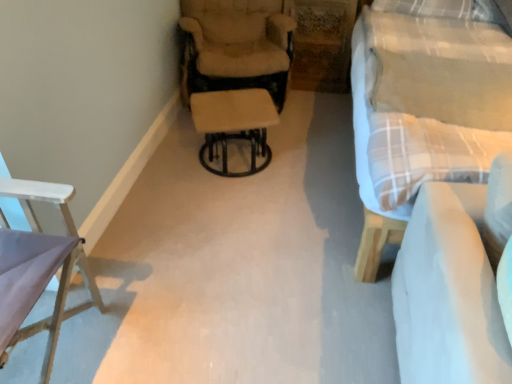
Where is `white fabric couch at lower right`? This screenshot has height=384, width=512. white fabric couch at lower right is located at coordinates (448, 292).

How different are the orientations of white fabric couch at lower right and beige fabric chair at center, the second chair viewed from the left, in degrees?

The facing directions of white fabric couch at lower right and beige fabric chair at center, the second chair viewed from the left, are 60.5 degrees apart.

Could you tell me if white fabric couch at lower right is facing beige fabric chair at center, the second chair viewed from the left?

No.

Considering the positions of point (434, 380) and point (263, 154), is point (434, 380) closer or farther from the camera than point (263, 154)?

Point (434, 380) appears to be closer to the viewer than point (263, 154).

From a real-world perspective, is white fabric couch at lower right physically located above or below beige fabric chair at center, the 2th chair when ordered from front to back?

Clearly, from a real-world perspective, white fabric couch at lower right is above beige fabric chair at center, the 2th chair when ordered from front to back.

Could white wood chair at left, acting as the 1th chair starting from the front, be considered to be inside white fabric couch at lower right?

No, white wood chair at left, acting as the 1th chair starting from the front, is not a part of white fabric couch at lower right.

From the image's perspective, would you say white fabric couch at lower right is shown under white wood chair at left, which appears as the second chair when viewed from the top?

Yes, from the image's perspective, white fabric couch at lower right is below white wood chair at left, which appears as the second chair when viewed from the top.

Is white fabric couch at lower right not close to white wood chair at left, acting as the 1th chair starting from the front?

Yes.

Does white fabric couch at lower right come in front of white wood chair at left, acting as the 1th chair starting from the front?

Yes, it is.

Is white fabric couch at lower right inside the boundaries of black metal stool at center, or outside?

white fabric couch at lower right is outside black metal stool at center.

Between white fabric couch at lower right and black metal stool at center, which one has less height?

Standing shorter between the two is black metal stool at center.

Does white fabric couch at lower right appear on the left side of black metal stool at center?

→ No.

Does white fabric couch at lower right touch black metal stool at center?

No, white fabric couch at lower right is not in contact with black metal stool at center.

Which of these two, white fabric couch at lower right or plaid fabric studio couch at right, stands shorter?

white fabric couch at lower right is shorter.

This screenshot has height=384, width=512. There is a plaid fabric studio couch at right. In order to click on couch above it (from a real-world perspective) in this screenshot , I will do `click(448, 292)`.

Between white fabric couch at lower right and plaid fabric studio couch at right, which one is positioned in front?

white fabric couch at lower right is more forward.

From the image's perspective, is white fabric couch at lower right under plaid fabric studio couch at right?

Yes, from the image's perspective, white fabric couch at lower right is below plaid fabric studio couch at right.

Are plaid fabric studio couch at right and black metal stool at center located far from each other?

plaid fabric studio couch at right is near black metal stool at center, not far away.

Is plaid fabric studio couch at right turned away from black metal stool at center?

plaid fabric studio couch at right is not turned away from black metal stool at center.

From the image's perspective, is plaid fabric studio couch at right above or below black metal stool at center?

plaid fabric studio couch at right is above black metal stool at center.

Is plaid fabric studio couch at right inside the boundaries of black metal stool at center, or outside?

plaid fabric studio couch at right exists outside the volume of black metal stool at center.

Which of these two, black metal stool at center or beige fabric chair at center, the 1th chair positioned from the back, is thinner?

With smaller width is black metal stool at center.

Considering the sizes of black metal stool at center and beige fabric chair at center, placed as the second chair when sorted from bottom to top, in the image, is black metal stool at center bigger or smaller than beige fabric chair at center, placed as the second chair when sorted from bottom to top,?

black metal stool at center is smaller than beige fabric chair at center, placed as the second chair when sorted from bottom to top.

How different are the orientations of black metal stool at center and beige fabric chair at center, the second chair viewed from the left, in degrees?

There is a 0.151-degree angle between the facing directions of black metal stool at center and beige fabric chair at center, the second chair viewed from the left.

Relative to beige fabric chair at center, arranged as the 1th chair when viewed from the top, is black metal stool at center in front or behind?

Visually, black metal stool at center is located in front of beige fabric chair at center, arranged as the 1th chair when viewed from the top.

Which object is positioned more to the left, white wood chair at left, the 1th chair ordered from the bottom, or white fabric couch at lower right?

white wood chair at left, the 1th chair ordered from the bottom, is more to the left.

From the image's perspective, is white wood chair at left, positioned as the second chair in right-to-left order, above or below white fabric couch at lower right?

Based on their image positions, white wood chair at left, positioned as the second chair in right-to-left order, is located above white fabric couch at lower right.

Locate an element on the screen. The width and height of the screenshot is (512, 384). couch lying in front of the white wood chair at left, the 1th chair ordered from the bottom is located at coordinates (448, 292).

The width and height of the screenshot is (512, 384). I want to click on the 1st chair to the left of the white fabric couch at lower right, counting from the anchor's position, so click(236, 73).

The height and width of the screenshot is (384, 512). In order to click on couch that appears in front of the white wood chair at left, which appears as the second chair when viewed from the top in this screenshot , I will do `click(448, 292)`.

Looking at the image, which one is located closer to beige fabric chair at center, the 1th chair positioned from the back, plaid fabric studio couch at right or black metal stool at center?

The object closer to beige fabric chair at center, the 1th chair positioned from the back, is black metal stool at center.

Looking at the image, which one is located further to white wood chair at left, positioned as the first chair in left-to-right order, plaid fabric studio couch at right or white fabric couch at lower right?

plaid fabric studio couch at right is positioned further to the anchor white wood chair at left, positioned as the first chair in left-to-right order.

In the scene shown: When comparing their distances from beige fabric chair at center, the first chair from the right, does white wood chair at left, the 1th chair ordered from the bottom, or plaid fabric studio couch at right seem closer?

plaid fabric studio couch at right is positioned closer to the anchor beige fabric chair at center, the first chair from the right.

Consider the image. From the image, which object appears to be nearer to plaid fabric studio couch at right, white wood chair at left, which appears as the second chair when viewed from the top, or beige fabric chair at center, the 2th chair when ordered from front to back?

Among the two, beige fabric chair at center, the 2th chair when ordered from front to back, is located nearer to plaid fabric studio couch at right.

Which object lies further to the anchor point beige fabric chair at center, the first chair from the right, white fabric couch at lower right or black metal stool at center?

Among the two, white fabric couch at lower right is located further to beige fabric chair at center, the first chair from the right.

In the scene shown: Based on their spatial positions, is beige fabric chair at center, the first chair from the right, or plaid fabric studio couch at right further from black metal stool at center?

Based on the image, plaid fabric studio couch at right appears to be further to black metal stool at center.

Consider the image. Which object lies further to the anchor point plaid fabric studio couch at right, white fabric couch at lower right or black metal stool at center?

The object further to plaid fabric studio couch at right is black metal stool at center.

Estimate the real-world distances between objects in this image. Which object is closer to beige fabric chair at center, the first chair from the right, black metal stool at center or plaid fabric studio couch at right?

black metal stool at center lies closer to beige fabric chair at center, the first chair from the right, than the other object.

Where is `stool positioned between white fabric couch at lower right and beige fabric chair at center, the 1th chair positioned from the back, from near to far`? This screenshot has height=384, width=512. stool positioned between white fabric couch at lower right and beige fabric chair at center, the 1th chair positioned from the back, from near to far is located at coordinates (234, 125).

Locate an element on the screen. studio couch between white fabric couch at lower right and black metal stool at center from front to back is located at coordinates 424,107.

The image size is (512, 384). Identify the location of chair between black metal stool at center and plaid fabric studio couch at right. (236, 73).

This screenshot has height=384, width=512. In order to click on studio couch between white fabric couch at lower right and beige fabric chair at center, the second chair viewed from the left, in the front-back direction in this screenshot , I will do `click(424, 107)`.